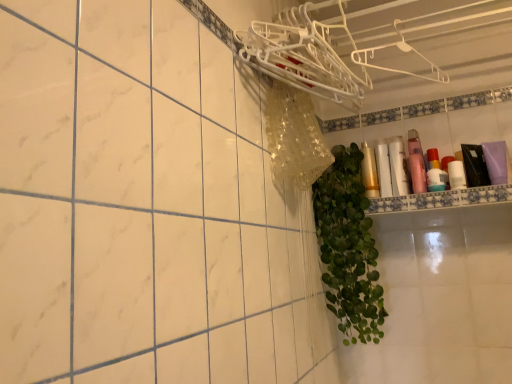
I want to click on vacant point above white plastic hanger at upper right, the first hanger in the left-to-right sequence (from a real-world perspective), so click(315, 13).